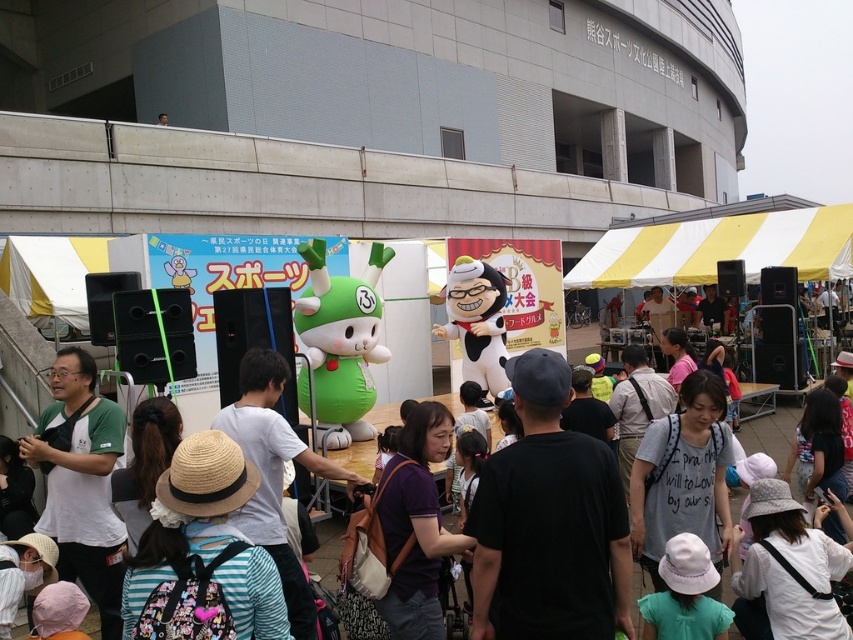
You are organizing a photo shoot at this event and need to position the black matte shirt at center and the matte green plush toy at center in a way that they are both visible in the frame. Given their sizes, which object should you place closer to the camera to ensure both are visible without one blocking the other?

Since the black matte shirt at center is smaller than the matte green plush toy at center, you should place the black matte shirt at center closer to the camera. This way, its smaller size will still be visible, and the larger matte green plush toy at center can be positioned slightly further back, ensuring neither blocks the other.

You are standing at the event and want to take a photo of the black matte shirt at center. If your camera has a maximum focus range of 3 meters, will you be able to capture a clear photo?

The black matte shirt at center is 3.44 meters away from the viewer. Since the camera can only focus up to 3 meters, it won wait be able to capture a clear photo.